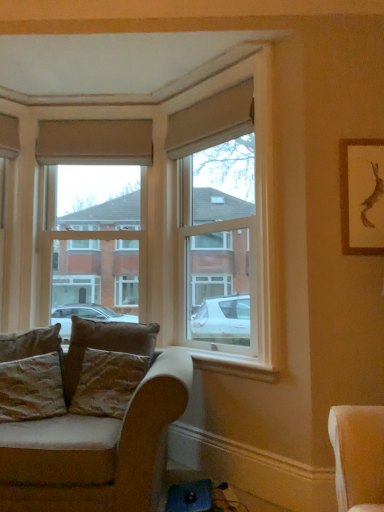
Question: Which direction should I rotate to look at clear glass window at center, arranged as the 2th window when viewed from the right?

Choices:
 (A) right
 (B) left

Answer: (B)

Question: Is brown velvety pillow at lower left, which is the second pillow from left to right, facing away from velvet brown pillow at lower left, marked as the third pillow in a left-to-right arrangement?

Choices:
 (A) yes
 (B) no

Answer: (A)

Question: Considering the relative sizes of brown velvety pillow at lower left, which is the second pillow from left to right, and velvet brown pillow at lower left, marked as the third pillow in a left-to-right arrangement, in the image provided, is brown velvety pillow at lower left, which is the second pillow from left to right, shorter than velvet brown pillow at lower left, marked as the third pillow in a left-to-right arrangement,?

Choices:
 (A) yes
 (B) no

Answer: (B)

Question: From a real-world perspective, is brown velvety pillow at lower left, which appears as the second pillow when viewed from the right, beneath velvet brown pillow at lower left, the 1th pillow from the right?

Choices:
 (A) yes
 (B) no

Answer: (B)

Question: Is brown velvety pillow at lower left, which is the second pillow from left to right, surrounding velvet brown pillow at lower left, the 1th pillow from the right?

Choices:
 (A) no
 (B) yes

Answer: (A)

Question: Can you confirm if brown velvety pillow at lower left, which is the second pillow from left to right, is smaller than velvet brown pillow at lower left, marked as the third pillow in a left-to-right arrangement?

Choices:
 (A) no
 (B) yes

Answer: (A)

Question: Is brown velvety pillow at lower left, which appears as the second pillow when viewed from the right, wider than velvet brown pillow at lower left, marked as the third pillow in a left-to-right arrangement?

Choices:
 (A) yes
 (B) no

Answer: (B)

Question: Is clear glass window at center, the 1th window from the right, bigger than velvet brown pillow at lower left, marked as the third pillow in a left-to-right arrangement?

Choices:
 (A) yes
 (B) no

Answer: (A)

Question: Does clear glass window at center, which appears as the second window when viewed from the left, come in front of velvet brown pillow at lower left, the 1th pillow from the right?

Choices:
 (A) yes
 (B) no

Answer: (B)

Question: Is clear glass window at center, which appears as the second window when viewed from the left, shorter than velvet brown pillow at lower left, the 1th pillow from the right?

Choices:
 (A) no
 (B) yes

Answer: (A)

Question: From a real-world perspective, is clear glass window at center, the 1th window from the right, physically below velvet brown pillow at lower left, marked as the third pillow in a left-to-right arrangement?

Choices:
 (A) yes
 (B) no

Answer: (B)

Question: Is clear glass window at center, the 1th window from the right, facing towards velvet brown pillow at lower left, the 1th pillow from the right?

Choices:
 (A) no
 (B) yes

Answer: (B)

Question: Considering the relative sizes of clear glass window at center, which appears as the second window when viewed from the left, and velvet brown pillow at lower left, marked as the third pillow in a left-to-right arrangement, in the image provided, is clear glass window at center, which appears as the second window when viewed from the left, wider than velvet brown pillow at lower left, marked as the third pillow in a left-to-right arrangement,?

Choices:
 (A) no
 (B) yes

Answer: (B)

Question: Are beige fabric curtain at upper center, the 2th curtain in the front-to-back sequence, and velvet brown pillow at lower left, marked as the third pillow in a left-to-right arrangement, far apart?

Choices:
 (A) yes
 (B) no

Answer: (A)